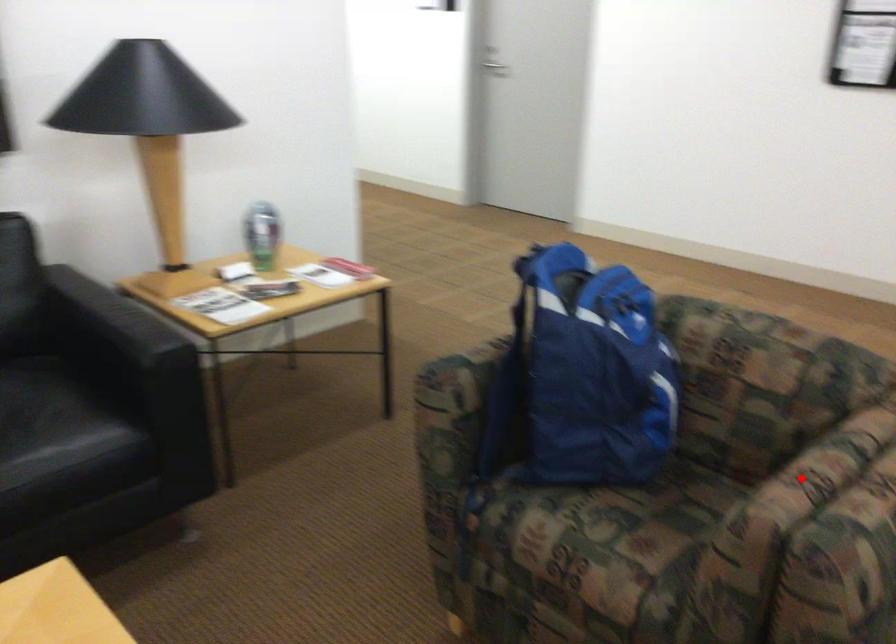
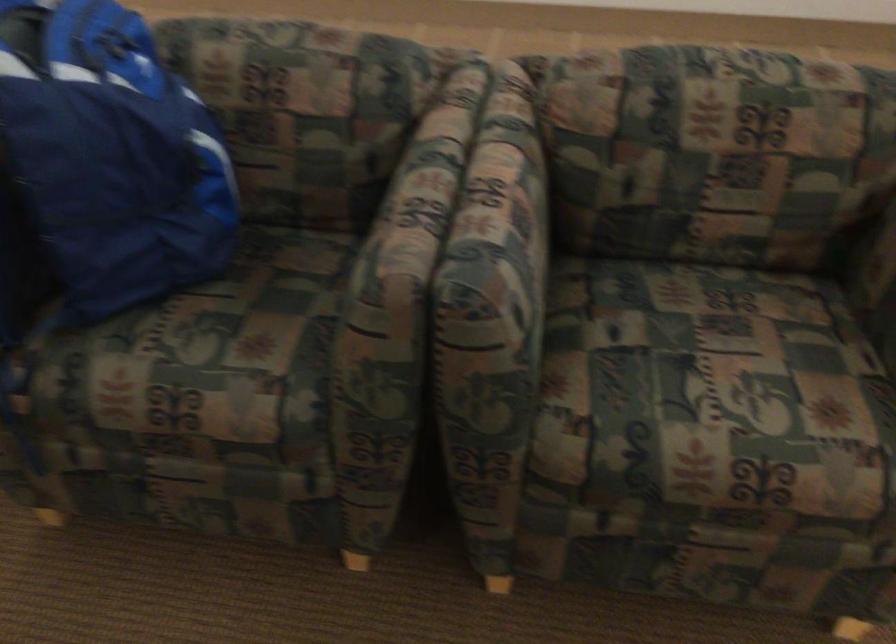
Find the pixel in the second image that matches the highlighted location in the first image.

(412, 207)